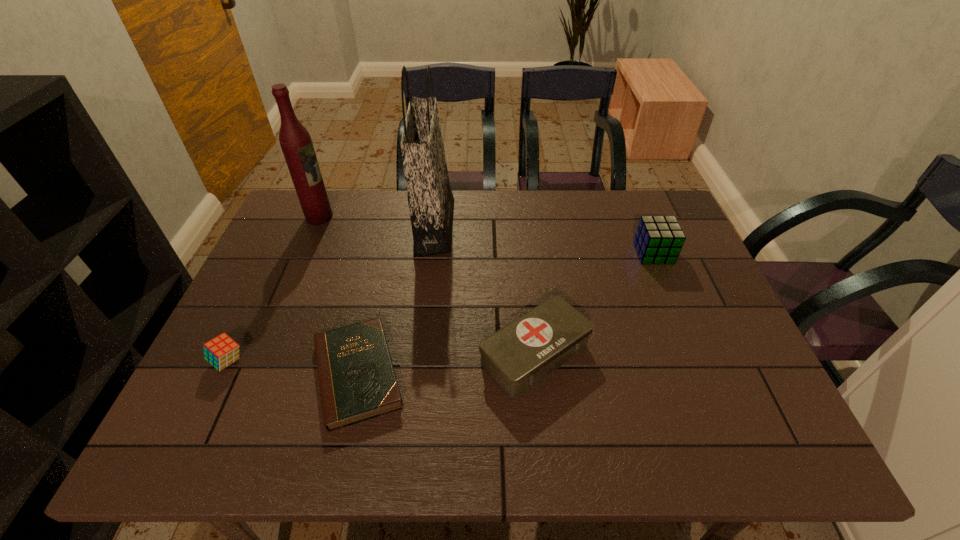
This screenshot has width=960, height=540. I want to click on free space located on the left of the third tallest object, so click(x=599, y=253).

Find the location of a particular element. The image size is (960, 540). free region located 0.250m on the back of the first-aid kit is located at coordinates (523, 251).

Locate an element on the screen. The height and width of the screenshot is (540, 960). vacant position located 0.140m on the right of the left cube is located at coordinates (305, 361).

Locate an element on the screen. Image resolution: width=960 pixels, height=540 pixels. vacant space located 0.070m on the left of the shortest object is located at coordinates (276, 374).

The height and width of the screenshot is (540, 960). Identify the location of shopping bag that is at the far edge. (431, 203).

Identify the location of liquor that is at the far edge. (295, 141).

This screenshot has width=960, height=540. Find the location of `object that is at the near edge`. object that is at the near edge is located at coordinates (357, 380).

Identify the location of liquor located at the left edge. The height and width of the screenshot is (540, 960). (295, 141).

Where is `cube situated at the left edge`? cube situated at the left edge is located at coordinates (222, 351).

At what (x,y) coordinates should I click in order to perform the action: click on object that is at the right edge. Please return your answer as a coordinate pair (x, y). The image size is (960, 540). Looking at the image, I should click on (658, 239).